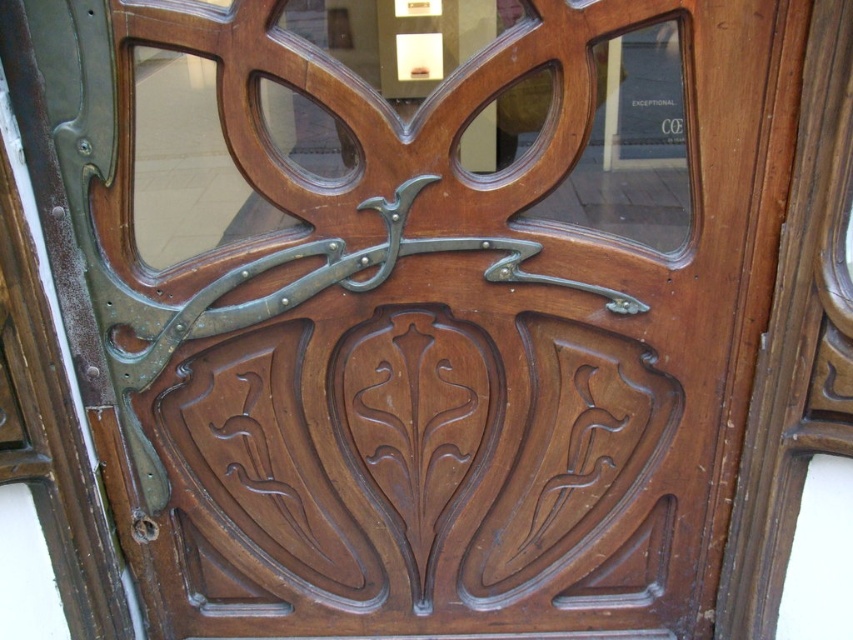
You are standing in front of the wooden door and want to place a small key exactly between the brown carved wood at center and the polished brass door handle at center. Which direction should you move the key from the handle to position it correctly?

You should move the key to the right from the polished brass door handle at center because the brown carved wood at center is located to the right of the handle, so placing the key between them requires moving it in that direction.

Based on the photo, you are an architect analyzing the door design. You notice a specific point on the door marked as point (422,461). What material is present at this location?

The point (422,461) marks brown carved wood at center.

In the scene shown: You are a door installer who needs to ensure proper spacing between the brown carved wood at center and the polished brass door handle at center. According to the design specifications, the minimum required distance between these two elements should be 10 inches. Can you confirm if the current placement meets the requirement?

The distance between the brown carved wood at center and the polished brass door handle at center is 11.37 inches, which exceeds the minimum required 10 inches. Therefore, the current placement meets the design specifications.